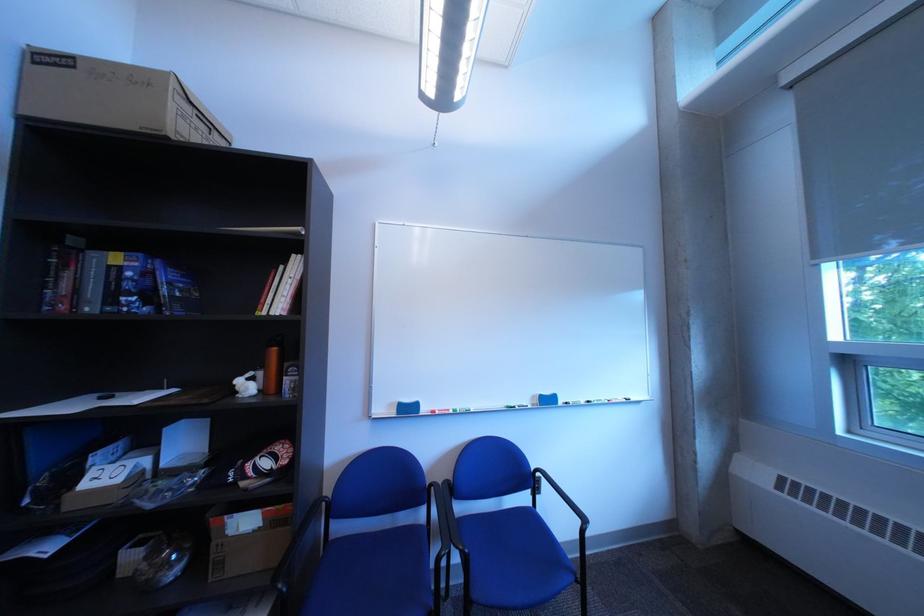
This screenshot has width=924, height=616. Find the location of `small cardboard box`. small cardboard box is located at coordinates (247, 540).